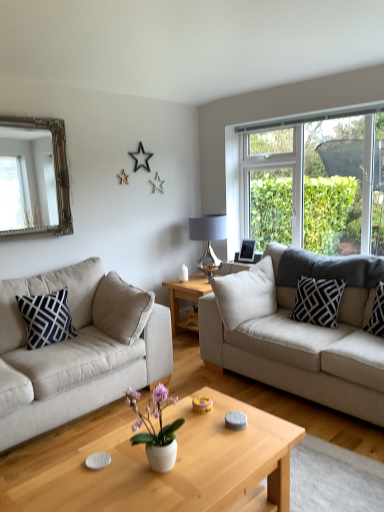
Question: Based on their positions, is navy blue/white geometric pillow at left, the first pillow when ordered from left to right, located to the left or right of silver/gilded mirror at upper left?

Choices:
 (A) left
 (B) right

Answer: (B)

Question: From a real-world perspective, relative to silver/gilded mirror at upper left, is navy blue/white geometric pillow at left, which is the third pillow in right-to-left order, vertically above or below?

Choices:
 (A) above
 (B) below

Answer: (B)

Question: Which object is positioned farthest from the light wood coffee table at center, which is the 1th coffee table from front to back?

Choices:
 (A) clear glass window at right
 (B) wooden coffee table at center, which is counted as the second coffee table, starting from the front
 (C) silver metallic picture frame at upper right
 (D) silver/gilded mirror at upper left
 (E) navy blue/white geometric pillow at left, which is the third pillow in right-to-left order

Answer: (A)

Question: Based on their relative distances, which object is farther from the navy blue/white geometric pillow at left, which is the third pillow in right-to-left order?

Choices:
 (A) black cotton pillow at right, placed as the 1th pillow when sorted from right to left
 (B) silver/gilded mirror at upper left
 (C) metallic silver lamp at center
 (D) white ceramic pot at center
 (E) light wood coffee table at center, which is counted as the 1th coffee table, starting from the bottom

Answer: (A)